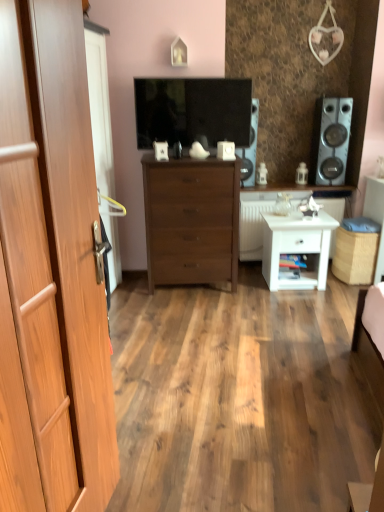
Locate an element on the screen. vacant area that is in front of brown wooden chest of drawers at center is located at coordinates (192, 308).